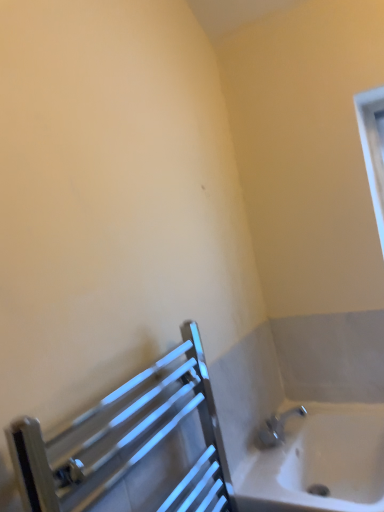
This screenshot has height=512, width=384. Find the location of `polished chrome towel rail at lower left`. polished chrome towel rail at lower left is located at coordinates (133, 446).

What do you see at coordinates (133, 446) in the screenshot?
I see `polished chrome towel rail at lower left` at bounding box center [133, 446].

Image resolution: width=384 pixels, height=512 pixels. I want to click on white glossy bathtub at lower right, so click(x=319, y=462).

What do you see at coordinates (319, 462) in the screenshot? I see `white glossy bathtub at lower right` at bounding box center [319, 462].

Locate an element on the screen. The height and width of the screenshot is (512, 384). polished chrome towel rail at lower left is located at coordinates (133, 446).

Is polished chrome towel rail at lower left to the right of white glossy bathtub at lower right from the viewer's perspective?

No.

Is polished chrome towel rail at lower left further to camera compared to white glossy bathtub at lower right?

No.

Does point (165, 490) lie in front of point (365, 498)?

Yes.

From the image's perspective, does polished chrome towel rail at lower left appear lower than white glossy bathtub at lower right?

Actually, polished chrome towel rail at lower left appears above white glossy bathtub at lower right in the image.

From a real-world perspective, who is located lower, polished chrome towel rail at lower left or white glossy bathtub at lower right?

From a 3D spatial view, white glossy bathtub at lower right is below.

Does polished chrome towel rail at lower left have a greater width compared to white glossy bathtub at lower right?

In fact, polished chrome towel rail at lower left might be narrower than white glossy bathtub at lower right.

Consider the image. Is polished chrome towel rail at lower left taller or shorter than white glossy bathtub at lower right?

In the image, polished chrome towel rail at lower left appears to be taller than white glossy bathtub at lower right.

Does polished chrome towel rail at lower left have a smaller size compared to white glossy bathtub at lower right?

Yes.

Can white glossy bathtub at lower right be found inside polished chrome towel rail at lower left?

No, white glossy bathtub at lower right is not inside polished chrome towel rail at lower left.

Is polished chrome towel rail at lower left far from white glossy bathtub at lower right?

No, there isn't a large distance between polished chrome towel rail at lower left and white glossy bathtub at lower right.

Could you tell me if polished chrome towel rail at lower left is facing white glossy bathtub at lower right?

No, polished chrome towel rail at lower left is not facing towards white glossy bathtub at lower right.

Can you tell me how much polished chrome towel rail at lower left and white glossy bathtub at lower right differ in facing direction?

The facing directions of polished chrome towel rail at lower left and white glossy bathtub at lower right are 0.783 degrees apart.

In the image, there is a polished chrome towel rail at lower left. Where is `bathtub below it (from the image's perspective)`? bathtub below it (from the image's perspective) is located at coordinates (319, 462).

Is white glossy bathtub at lower right at the right side of polished chrome towel rail at lower left?

Correct, you'll find white glossy bathtub at lower right to the right of polished chrome towel rail at lower left.

Considering their positions, is white glossy bathtub at lower right located in front of or behind polished chrome towel rail at lower left?

white glossy bathtub at lower right is behind polished chrome towel rail at lower left.

Is point (297, 471) positioned in front of point (199, 480)?

No, it is behind (199, 480).

In the scene shown: From the image's perspective, is white glossy bathtub at lower right below polished chrome towel rail at lower left?

Yes, from the image's perspective, white glossy bathtub at lower right is below polished chrome towel rail at lower left.

From a real-world perspective, does white glossy bathtub at lower right stand above polished chrome towel rail at lower left?

No, from a real-world perspective, white glossy bathtub at lower right is not on top of polished chrome towel rail at lower left.

Is white glossy bathtub at lower right wider than polished chrome towel rail at lower left?

Yes.

Between white glossy bathtub at lower right and polished chrome towel rail at lower left, which one has less height?

Standing shorter between the two is white glossy bathtub at lower right.

Which of these two, white glossy bathtub at lower right or polished chrome towel rail at lower left, is smaller?

Smaller between the two is polished chrome towel rail at lower left.

Is white glossy bathtub at lower right surrounding polished chrome towel rail at lower left?

No, polished chrome towel rail at lower left is located outside of white glossy bathtub at lower right.

Would you say white glossy bathtub at lower right is a long distance from polished chrome towel rail at lower left?

No.

Is white glossy bathtub at lower right oriented away from polished chrome towel rail at lower left?

white glossy bathtub at lower right does not have its back to polished chrome towel rail at lower left.

Can you tell me how much white glossy bathtub at lower right and polished chrome towel rail at lower left differ in facing direction?

The angular difference between white glossy bathtub at lower right and polished chrome towel rail at lower left is 0.783 degrees.

The width and height of the screenshot is (384, 512). What are the coordinates of `balustrade located above the white glossy bathtub at lower right (from the image's perspective)` in the screenshot? It's located at (133, 446).

Locate an element on the screen. balustrade that appears in front of the white glossy bathtub at lower right is located at coordinates (133, 446).

This screenshot has width=384, height=512. What are the coordinates of `balustrade above the white glossy bathtub at lower right (from a real-world perspective)` in the screenshot? It's located at (133, 446).